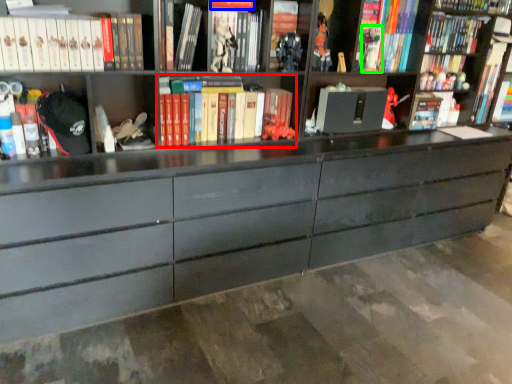
Question: Considering the real-world distances, which object is farthest from book (highlighted by a red box)? book (highlighted by a blue box) or toy (highlighted by a green box)?

Choices:
 (A) book
 (B) toy

Answer: (B)